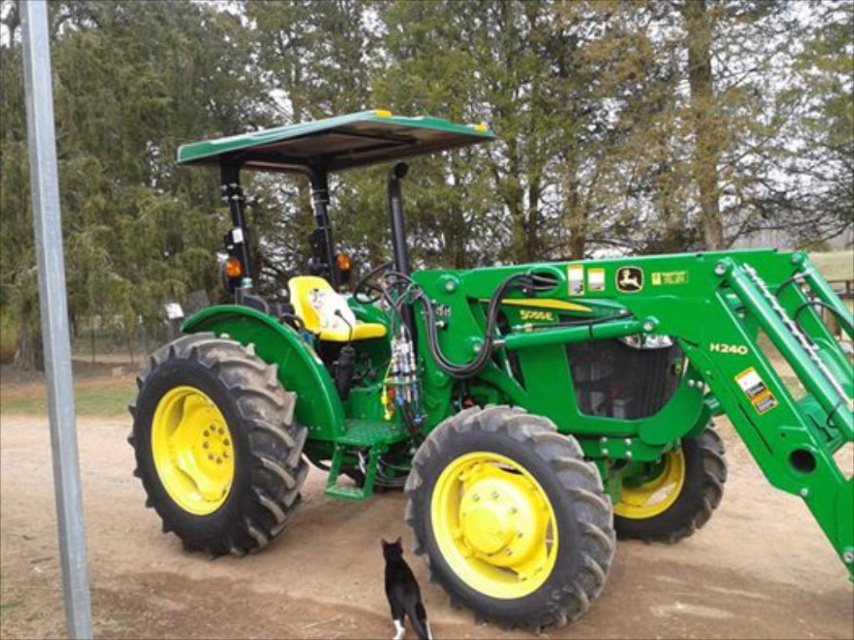
Is dirt track at lower center thinner than black fur cat at lower center?

In fact, dirt track at lower center might be wider than black fur cat at lower center.

Who is lower down, dirt track at lower center or black fur cat at lower center?

Positioned lower is black fur cat at lower center.

Is point (349, 586) positioned behind point (390, 552)?

Yes, it is behind point (390, 552).

Where is `dirt track at lower center`? Image resolution: width=854 pixels, height=640 pixels. dirt track at lower center is located at coordinates (229, 561).

Looking at this image, can you confirm if green matte tractor at center is wider than black fur cat at lower center?

Indeed, green matte tractor at center has a greater width compared to black fur cat at lower center.

What do you see at coordinates (488, 392) in the screenshot? I see `green matte tractor at center` at bounding box center [488, 392].

Is point (316, 356) closer to camera compared to point (398, 608)?

No, (316, 356) is behind (398, 608).

Find the location of a particular element. This screenshot has width=854, height=640. green matte tractor at center is located at coordinates (488, 392).

Which is in front, point (402, 332) or point (340, 524)?

Point (402, 332) is more forward.

Which of these two, green matte tractor at center or dirt track at lower center, stands taller?

green matte tractor at center

At what (x,y) coordinates should I click in order to perform the action: click on green matte tractor at center. Please return your answer as a coordinate pair (x, y). Looking at the image, I should click on (488, 392).